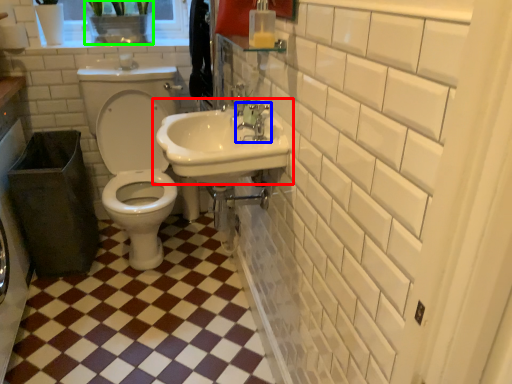
Question: Which is farther away from sink (highlighted by a red box)? tap (highlighted by a blue box) or plant (highlighted by a green box)?

Choices:
 (A) tap
 (B) plant

Answer: (B)